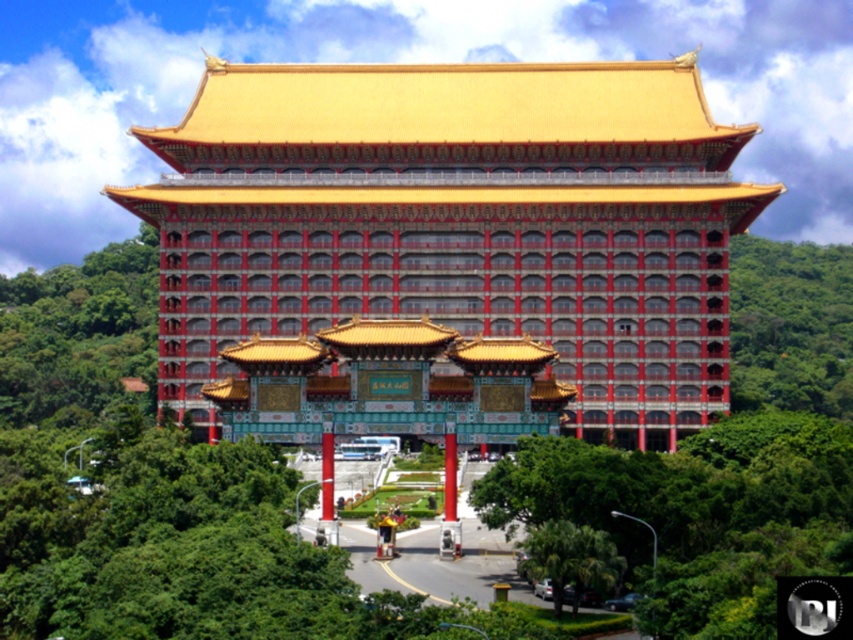
Is polished gold gate at center thinner than smooth red pillar at center?

No, polished gold gate at center is not thinner than smooth red pillar at center.

Does point (357, 396) lie behind point (444, 442)?

No, (357, 396) is closer to viewer.

Find the location of `polished gold gate at center`. polished gold gate at center is located at coordinates (389, 385).

Between red glossy building at center and smooth red pillar at center, which one is positioned higher?

red glossy building at center

Who is more forward, (517, 118) or (451, 515)?

Point (451, 515) is more forward.

Where is `red glossy building at center`? This screenshot has height=640, width=853. red glossy building at center is located at coordinates click(x=459, y=221).

Is green leafy tree at lower center in front of red glossy pillar at center?

Yes, it is.

Can you confirm if green leafy tree at lower center is positioned to the left of red glossy pillar at center?

Incorrect, green leafy tree at lower center is not on the left side of red glossy pillar at center.

Who is more forward, (x=578, y=577) or (x=322, y=493)?

Point (x=578, y=577) is more forward.

At what (x,y) coordinates should I click in order to perform the action: click on green leafy tree at lower center. Please return your answer as a coordinate pair (x, y). This screenshot has height=640, width=853. Looking at the image, I should click on (572, 560).